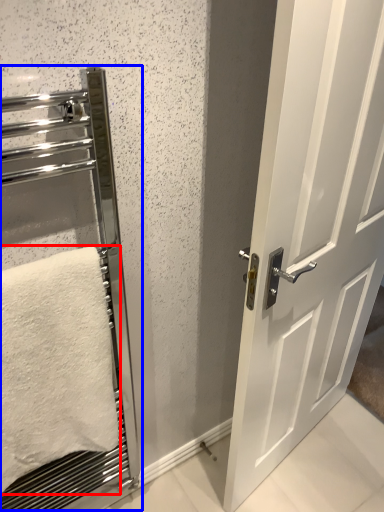
Question: Which point is closer to the camera, towel (highlighted by a red box) or elevator (highlighted by a blue box)?

Choices:
 (A) towel
 (B) elevator

Answer: (B)